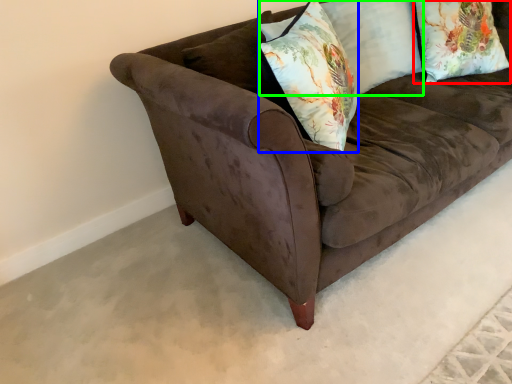
Question: Considering the real-world distances, which object is closest to pillow (highlighted by a red box)? throw pillow (highlighted by a blue box) or pillow (highlighted by a green box).

Choices:
 (A) throw pillow
 (B) pillow

Answer: (B)